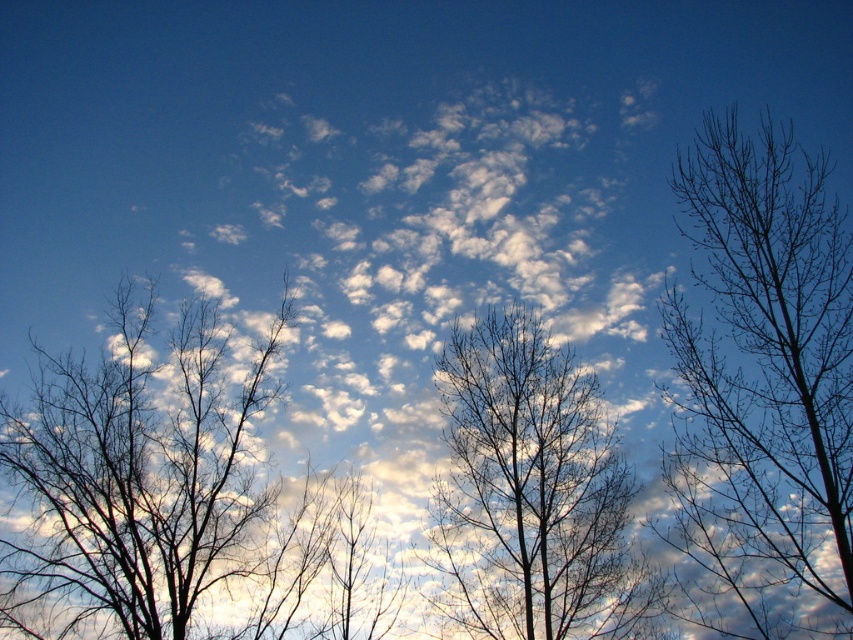
You are an astronomer observing a star map and notice two celestial objects. One is a cluster of stars forming a pattern resembling bare branches at right, and the other is a nebula located at point (762, 387). Which object is positioned further to the right in the sky?

The bare branches at right is positioned further to the right in the sky because it is explicitly labeled as being at the right, while the nebula at point (762, 387) has a coordinate that places it at 0.605 on the x and y axes, but without specific right positioning details, the branches are more to the right.

You are an artist sketching the scene and want to ensure the proportions between the bare branches at right and the silhouette bare tree at left are accurate. Which one should you draw wider in your sketch?

The bare branches at right should be drawn wider because their width surpasses that of the silhouette bare tree at left according to the description.